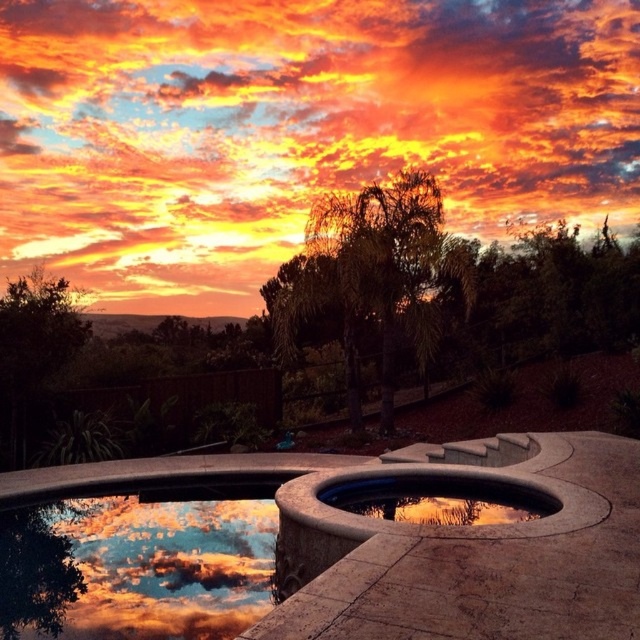
You are standing in the backyard pool area and notice a point marked at coordinates (x=296, y=129). What object is located at that specific point?

The orange cotton cloud at upper center is located at point (x=296, y=129).

You are standing in the backyard pool area and looking up at the sky. Which object, the orange cotton cloud at upper center or the smooth concrete pool at center, is located higher in the sky?

The orange cotton cloud at upper center is located higher in the sky than the smooth concrete pool at center because it is positioned over it.

You are standing in the backyard pool area and want to place a small garden gnome. The gnome must be placed such that it is positioned behind both the point at location (x=22, y=188) and the point at (x=477, y=486). Is this possible? Please explain using the spatial relationships between the points.

Since point (x=22, y=188) is behind point (x=477, y=486), placing the gnome behind both points would require it to be located behind the point at (x=477, y=486). This is possible as the spatial arrangement allows for such positioning.